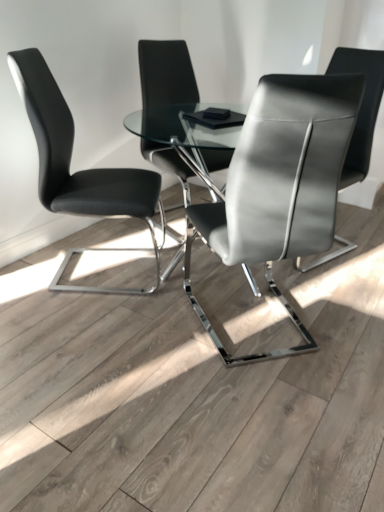
In order to click on vacant area on the back side of black leather chair at left, which appears as the fourth chair when viewed from the right in this screenshot , I will do `click(105, 231)`.